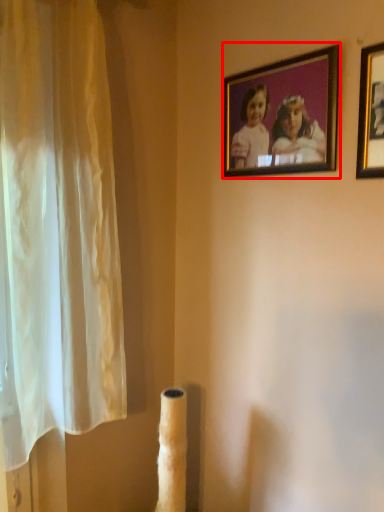
Question: In this image, where is picture frame (annotated by the red box) located relative to picture frame?

Choices:
 (A) right
 (B) left

Answer: (B)